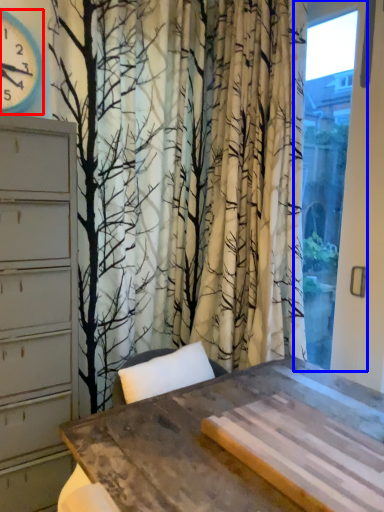
Question: Which point is further to the camera, clock (highlighted by a red box) or window (highlighted by a blue box)?

Choices:
 (A) clock
 (B) window

Answer: (A)